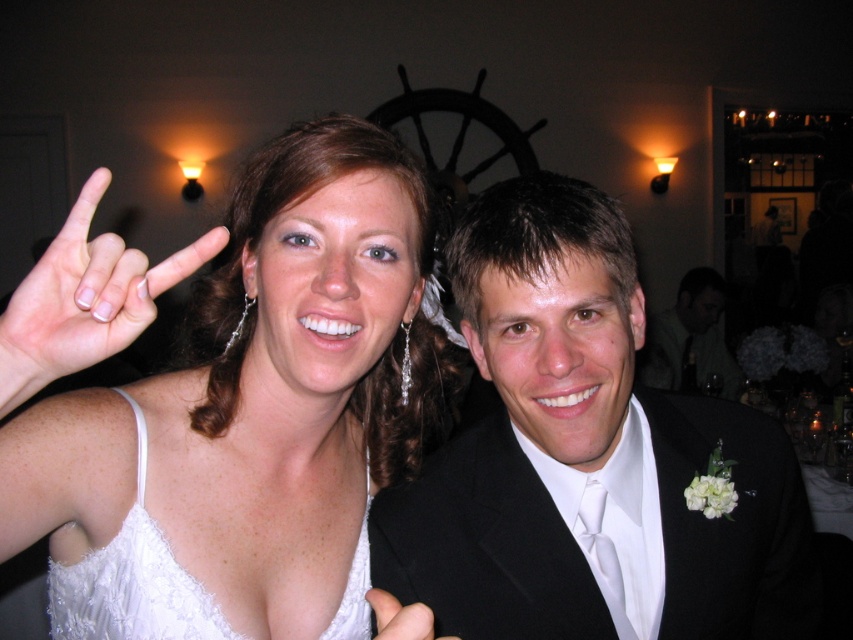
You are a photographer at a wedding reception. You need to adjust the lighting to ensure both the white satin dress at upper left and the white satin hand at center are clearly visible. Which object should you focus on first to ensure proper exposure, considering their positions?

The white satin dress at upper left is positioned on the left side of white satin hand at center. To ensure proper exposure, focus on the white satin dress at upper left first as it is closer to the left side and may require more light adjustment.